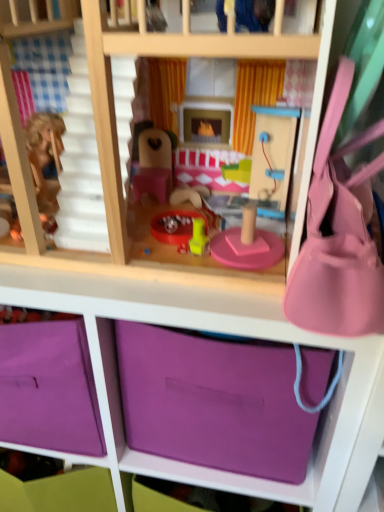
Question: Is purple matte storage box at lower center far away from pink fabric purse at right?

Choices:
 (A) no
 (B) yes

Answer: (A)

Question: Can you see purple matte storage box at lower center touching pink fabric purse at right?

Choices:
 (A) yes
 (B) no

Answer: (B)

Question: Considering the relative sizes of purple matte storage box at lower center and pink fabric purse at right in the image provided, is purple matte storage box at lower center shorter than pink fabric purse at right?

Choices:
 (A) yes
 (B) no

Answer: (B)

Question: From a real-world perspective, is purple matte storage box at lower center on top of pink fabric purse at right?

Choices:
 (A) no
 (B) yes

Answer: (A)

Question: From the image's perspective, does purple matte storage box at lower center appear lower than pink fabric purse at right?

Choices:
 (A) no
 (B) yes

Answer: (B)

Question: From a real-world perspective, is purple matte storage box at lower center below pink fabric purse at right?

Choices:
 (A) no
 (B) yes

Answer: (B)

Question: Is the position of purple matte storage box at lower center more distant than that of purple fabric storage at center?

Choices:
 (A) yes
 (B) no

Answer: (A)

Question: From the image's perspective, is purple matte storage box at lower center on top of purple fabric storage at center?

Choices:
 (A) no
 (B) yes

Answer: (B)

Question: Is purple matte storage box at lower center not within purple fabric storage at center?

Choices:
 (A) no
 (B) yes

Answer: (A)

Question: From a real-world perspective, does purple matte storage box at lower center stand above purple fabric storage at center?

Choices:
 (A) no
 (B) yes

Answer: (B)

Question: Is purple matte storage box at lower center positioned in front of purple fabric storage at center?

Choices:
 (A) no
 (B) yes

Answer: (A)

Question: Is purple matte storage box at lower center at the right side of purple fabric storage at center?

Choices:
 (A) yes
 (B) no

Answer: (A)

Question: Is purple matte storage box at lower center taller than pink wood bunk bed at center?

Choices:
 (A) no
 (B) yes

Answer: (A)